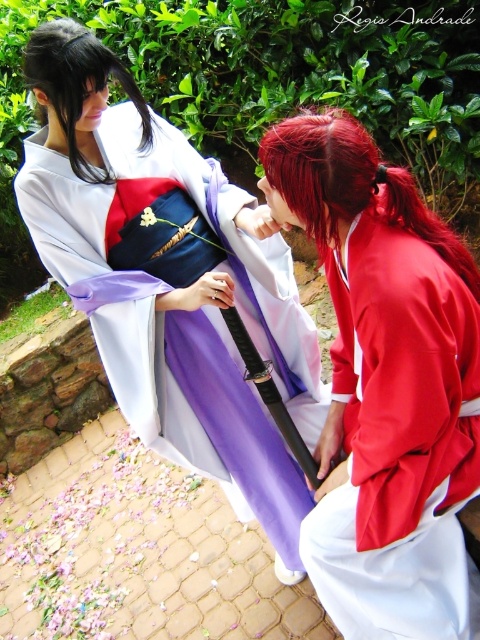
Is matte white kimono at center positioned in front of matte red kimono at center?

No.

Can you confirm if matte white kimono at center is positioned below matte red kimono at center?

Actually, matte white kimono at center is above matte red kimono at center.

Describe the element at coordinates (169, 282) in the screenshot. I see `matte white kimono at center` at that location.

Locate an element on the screen. matte white kimono at center is located at coordinates pos(169,282).

Is matte red kimono at center above black silky hair at upper left?

No, matte red kimono at center is not above black silky hair at upper left.

Is point (470, 481) more distant than point (87, 168)?

That is False.

Find the location of a particular element. matte red kimono at center is located at coordinates (385, 385).

At what (x,y) coordinates should I click in order to perform the action: click on matte red kimono at center. Please return your answer as a coordinate pair (x, y). Image resolution: width=480 pixels, height=640 pixels. Looking at the image, I should click on (385, 385).

Does matte white kimono at center appear on the right side of shiny red hair at center?

No, matte white kimono at center is not to the right of shiny red hair at center.

Between matte white kimono at center and shiny red hair at center, which one has less height?

shiny red hair at center

Find the location of a particular element. Image resolution: width=480 pixels, height=640 pixels. matte white kimono at center is located at coordinates (169, 282).